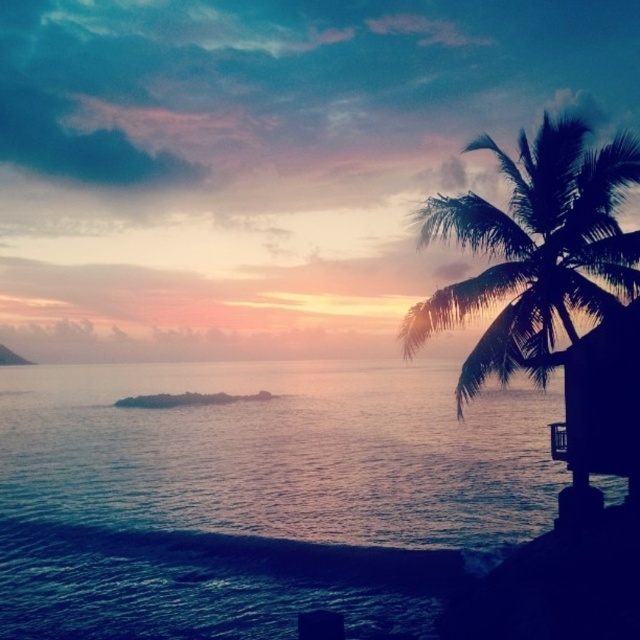
Question: Does blue water at center appear under dark brown wooden hut at right?

Choices:
 (A) no
 (B) yes

Answer: (B)

Question: Which point is closer to the camera?

Choices:
 (A) (109, 602)
 (B) (582, 136)

Answer: (B)

Question: Which object is the farthest from the dark brown wooden hut at right?

Choices:
 (A) silhouette leafy palm at right
 (B) blue water at center

Answer: (B)

Question: Does silhouette leafy palm at right have a greater width compared to dark brown wooden hut at right?

Choices:
 (A) yes
 (B) no

Answer: (A)

Question: Which point is closer to the camera?

Choices:
 (A) (320, 525)
 (B) (620, 328)

Answer: (B)

Question: Can you confirm if blue water at center is positioned above silhouette leafy palm at right?

Choices:
 (A) no
 (B) yes

Answer: (A)